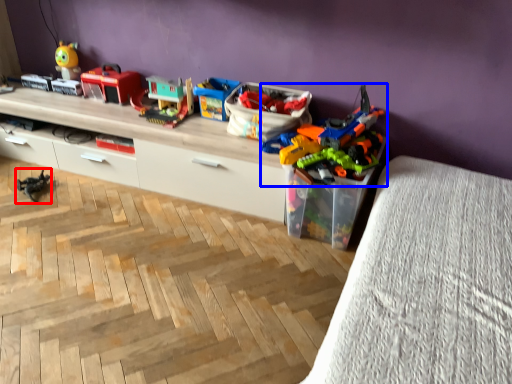
Question: Among these objects, which one is farthest to the camera, toy (highlighted by a red box) or toy (highlighted by a blue box)?

Choices:
 (A) toy
 (B) toy

Answer: (A)